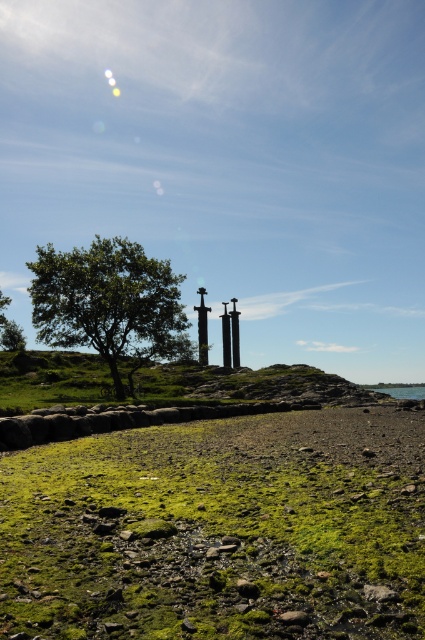
Question: Does green leafy tree at center lie in front of polished metal sword at center?

Choices:
 (A) yes
 (B) no

Answer: (A)

Question: Can you confirm if green mossy ground at lower center is positioned to the left of polished metal sword at center?

Choices:
 (A) yes
 (B) no

Answer: (B)

Question: Which of the following is the farthest from the observer?

Choices:
 (A) (224, 332)
 (B) (159, 612)
 (C) (238, 340)
 (D) (122, 296)

Answer: (C)

Question: Which point is closer to the camera taking this photo?

Choices:
 (A) (224, 356)
 (B) (234, 310)

Answer: (A)

Question: Which of the following is the farthest from the observer?

Choices:
 (A) black metal pole at center
 (B) polished metal sword at center
 (C) green mossy ground at lower center

Answer: (A)

Question: Is green leafy tree at center above polished metal sword at center?

Choices:
 (A) no
 (B) yes

Answer: (A)